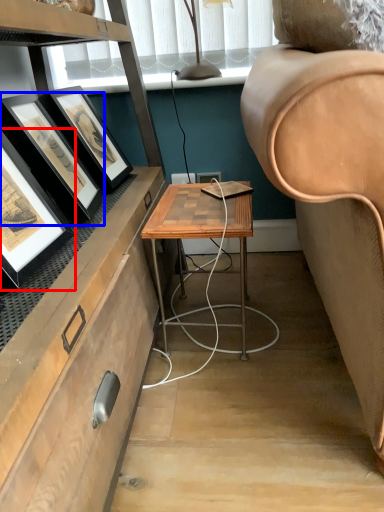
Question: Which point is closer to the camera, picture frame (highlighted by a red box) or picture frame (highlighted by a blue box)?

Choices:
 (A) picture frame
 (B) picture frame

Answer: (A)